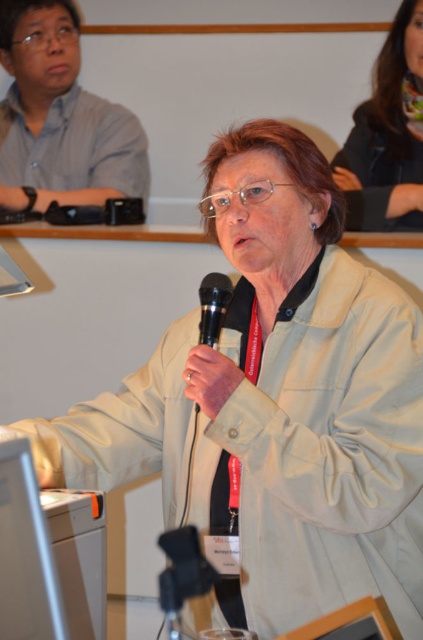
From the picture: Is dark brown leather jacket at upper right positioned behind black matte microphone at center?

Yes.

Can you confirm if dark brown leather jacket at upper right is positioned to the left of black matte microphone at center?

No, dark brown leather jacket at upper right is not to the left of black matte microphone at center.

Is point (364, 134) less distant than point (222, 310)?

No.

Locate an element on the screen. This screenshot has height=640, width=423. dark brown leather jacket at upper right is located at coordinates (387, 136).

Which is below, matte gray shirt at upper left or dark brown leather jacket at upper right?

dark brown leather jacket at upper right

Describe the element at coordinates (60, 116) in the screenshot. I see `matte gray shirt at upper left` at that location.

You are a GUI agent. You are given a task and a screenshot of the screen. Output one action in this format:
    pyautogui.click(x=<x>, y=<y>)
    Task: Click on the matte gray shirt at upper left
    
    Given the screenshot: What is the action you would take?
    pyautogui.click(x=60, y=116)

Who is higher up, matte gray shirt at upper left or black matte microphone at center?

matte gray shirt at upper left is higher up.

Who is more distant from viewer, (41, 60) or (213, 339)?

The point (41, 60) is behind.

At what (x,y) coordinates should I click in order to perform the action: click on matte gray shirt at upper left. Please return your answer as a coordinate pair (x, y). Looking at the image, I should click on (60, 116).